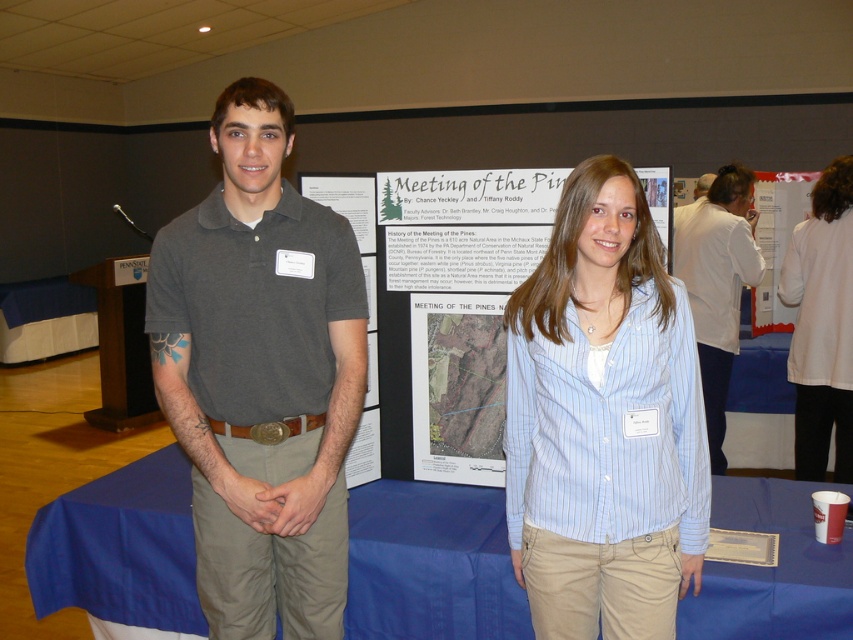
Does matte gray shirt at center have a smaller size compared to white striped shirt at center?

Indeed, matte gray shirt at center has a smaller size compared to white striped shirt at center.

Is matte gray shirt at center shorter than white striped shirt at center?

Yes, matte gray shirt at center is shorter than white striped shirt at center.

Locate an element on the screen. This screenshot has width=853, height=640. matte gray shirt at center is located at coordinates (260, 376).

Is matte gray shirt at center above blue striped shirt at center?

Yes.

Is point (155, 268) farther from camera compared to point (573, 296)?

Yes.

Who is more distant from viewer, (218, 499) or (537, 616)?

Point (218, 499)

Locate an element on the screen. The image size is (853, 640). matte gray shirt at center is located at coordinates (260, 376).

In the scene shown: Who is more distant from viewer, (741,605) or (837,401)?

Point (837,401)

Which is in front, point (465, 513) or point (801, 248)?

Positioned in front is point (465, 513).

Does point (799, 595) come behind point (845, 218)?

No, it is not.

Identify the location of blue fabric tablecloth at center. (430, 564).